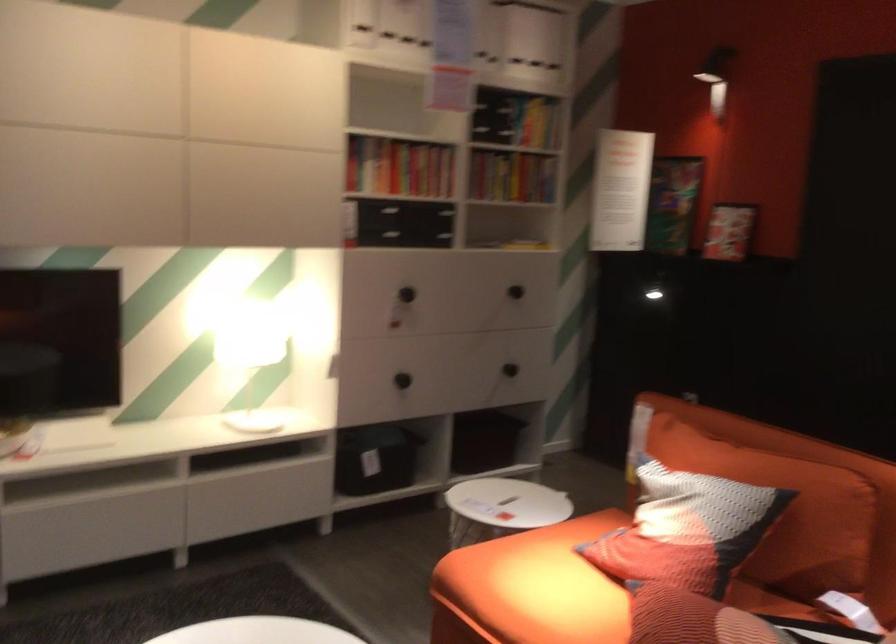
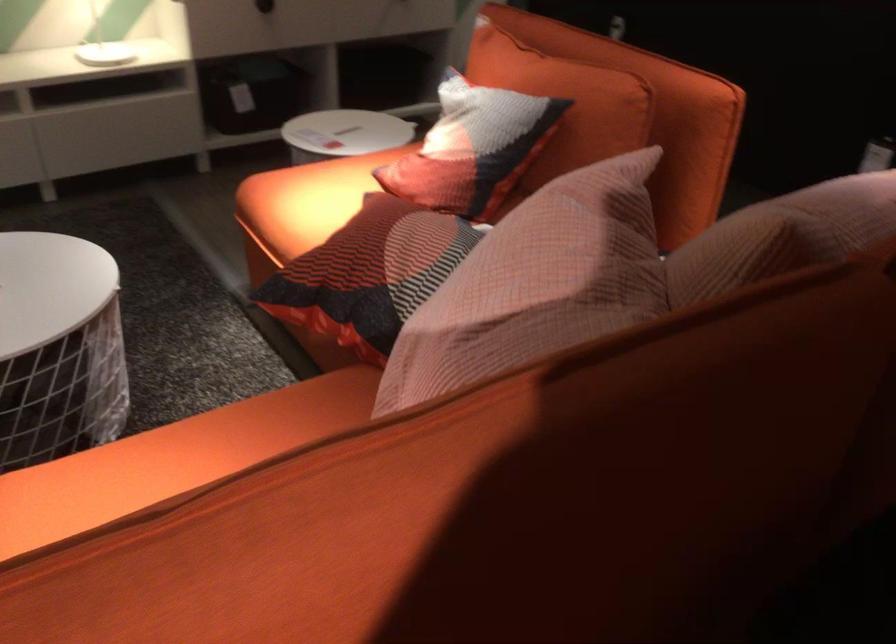
The point at (785,486) is marked in the first image. Where is the corresponding point in the second image?

(564, 102)